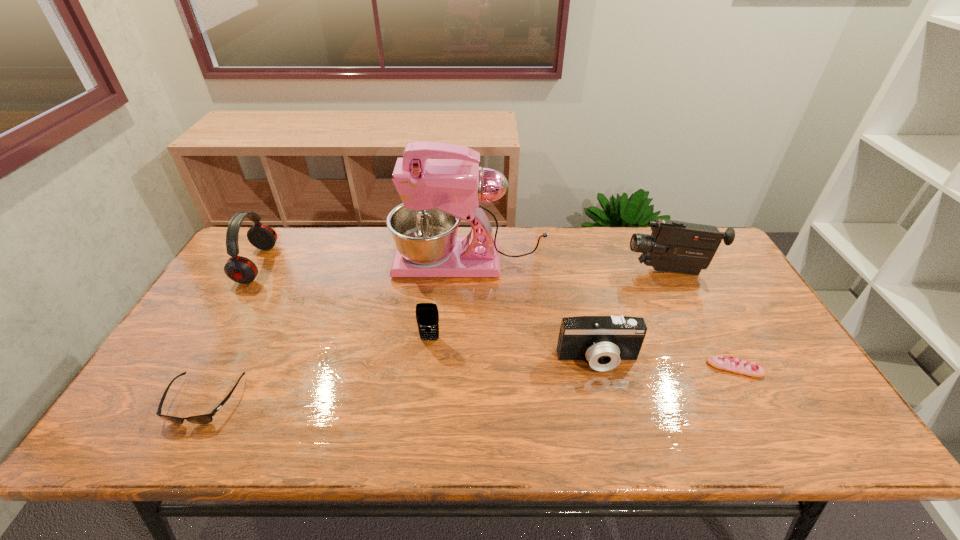
The width and height of the screenshot is (960, 540). In order to click on vacant space in between the nearer camcorder and the taller camcorder in this screenshot , I will do coord(634,315).

The image size is (960, 540). Identify the location of object that is the closest to the cellular telephone. (436, 193).

The width and height of the screenshot is (960, 540). I want to click on object that stands as the fifth closest to the earphone, so click(x=676, y=246).

Image resolution: width=960 pixels, height=540 pixels. I want to click on free spot that satisfies the following two spatial constraints: 1. on the lens of the eclair; 2. on the right side of the left camcorder, so click(600, 368).

In order to click on free space that satisfies the following two spatial constraints: 1. on the back side of the shortest object; 2. on the front-facing side of the farther camcorder in this screenshot , I will do `click(684, 271)`.

The image size is (960, 540). I want to click on free spot that satisfies the following two spatial constraints: 1. on the front-facing side of the taller camcorder; 2. on the right side of the shortest object, so click(718, 368).

This screenshot has width=960, height=540. Identify the location of vacant region that satisfies the following two spatial constraints: 1. on the front-facing side of the taller camcorder; 2. on the front-facing side of the sunglasses. (734, 400).